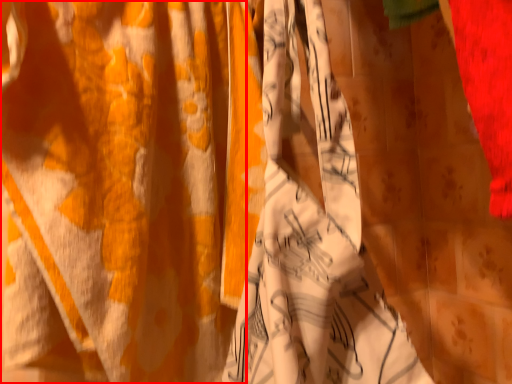
Question: Observing the image, what is the correct spatial positioning of curtain (annotated by the red box) in reference to clothing?

Choices:
 (A) left
 (B) right

Answer: (A)